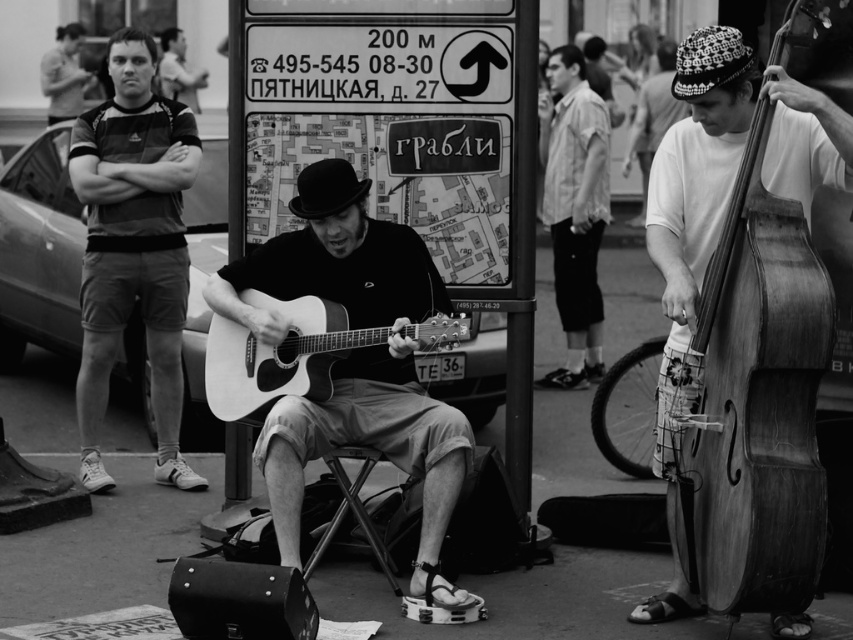
From the picture: You are a photographer trying to capture both the wooden cello at right and the matte acoustic guitar at center in a single frame. Which instrument should you position closer to the camera to make them appear the same size?

The wooden cello at right is thinner than the matte acoustic guitar at center, so you should position the wooden cello at right closer to the camera to make them appear the same size.

You are a photographer trying to capture a closeup of the wooden cello at right and the matte acoustic guitar at center. Which one should you focus on first if you want to ensure both are in focus without moving your camera?

The wooden cello at right is located above the matte acoustic guitar at center, so you should focus on the matte acoustic guitar at center first since it is closer to the camera. This way, adjusting the focus upwards will also capture the wooden cello at right in focus.